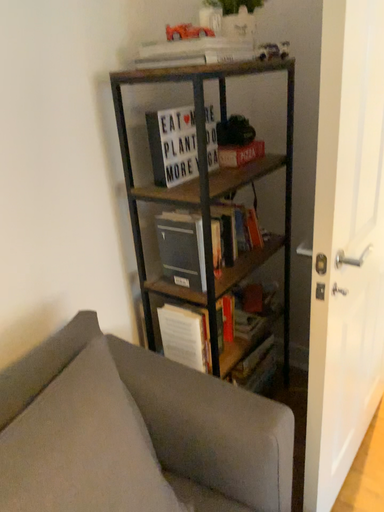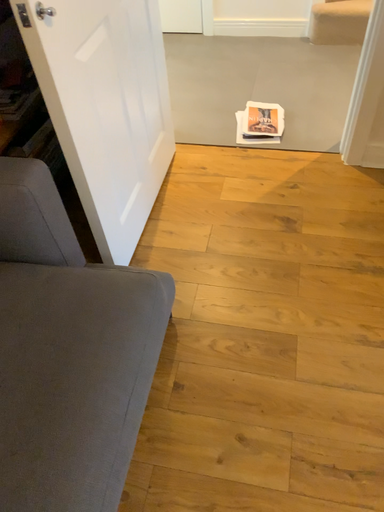
Question: How did the camera likely rotate when shooting the video?

Choices:
 (A) rotated right
 (B) rotated left

Answer: (A)